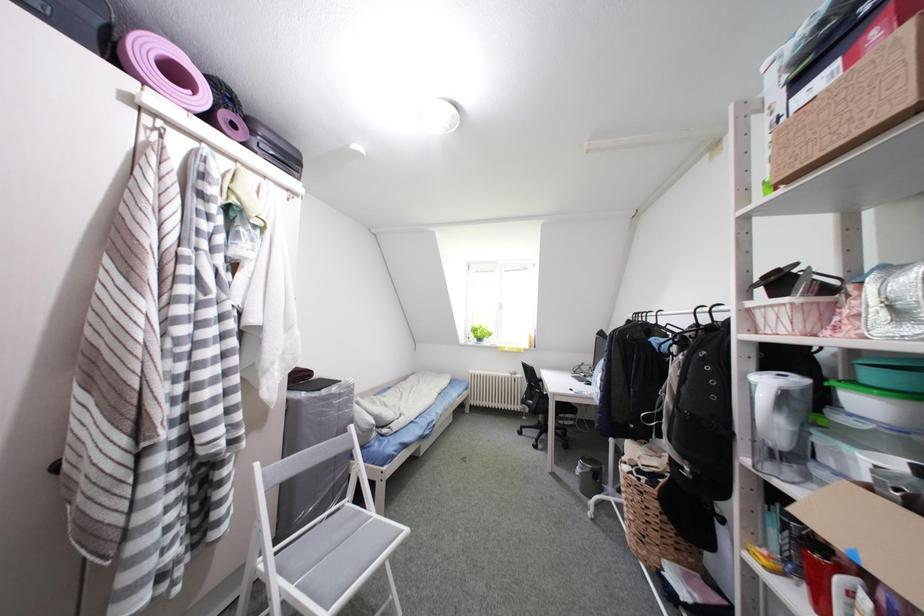
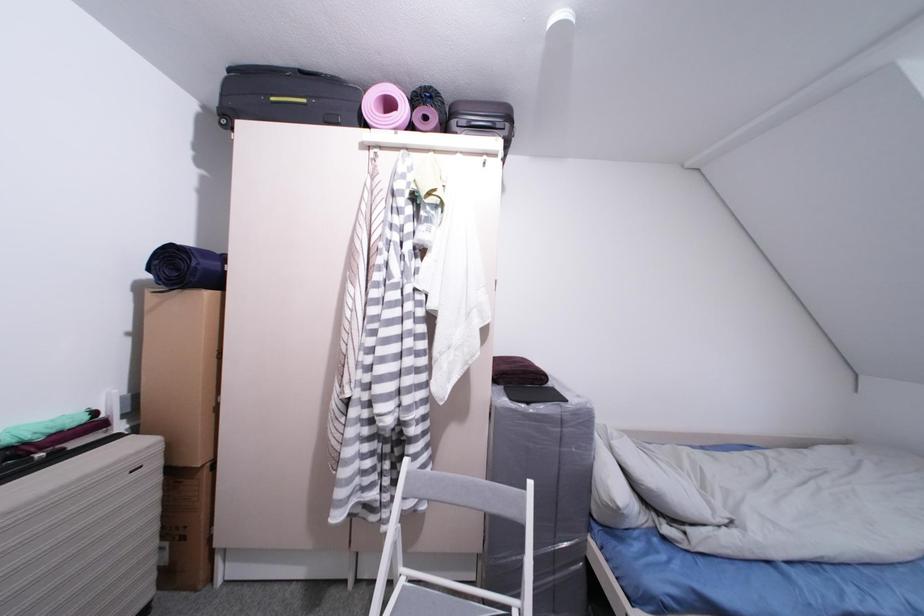
Question: How did the camera likely rotate?

Choices:
 (A) Left
 (B) Right
 (C) Up
 (D) Down

Answer: (A)